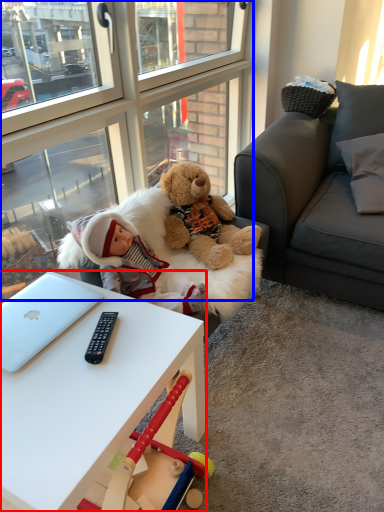
Question: Among these objects, which one is nearest to the camera, desk (highlighted by a red box) or glass door (highlighted by a blue box)?

Choices:
 (A) desk
 (B) glass door

Answer: (A)